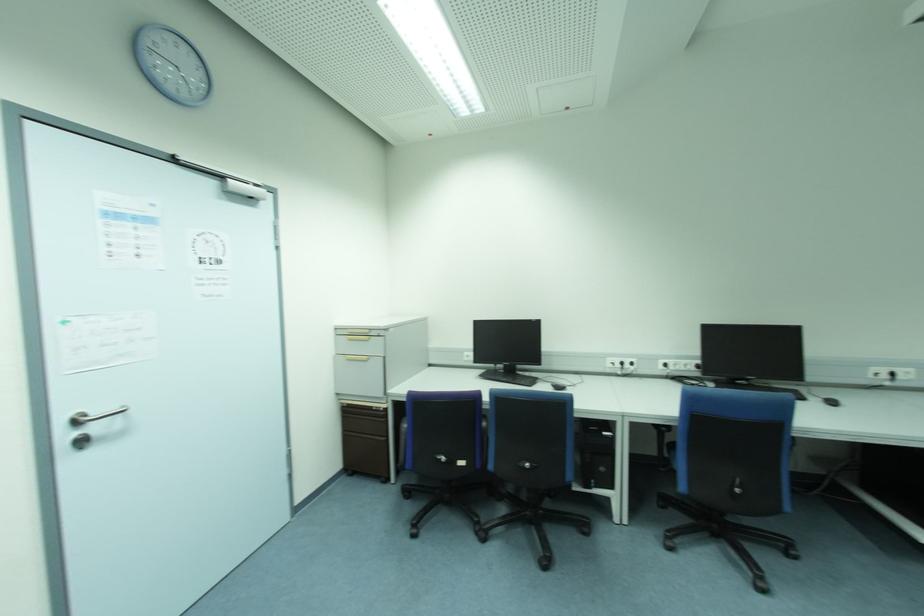
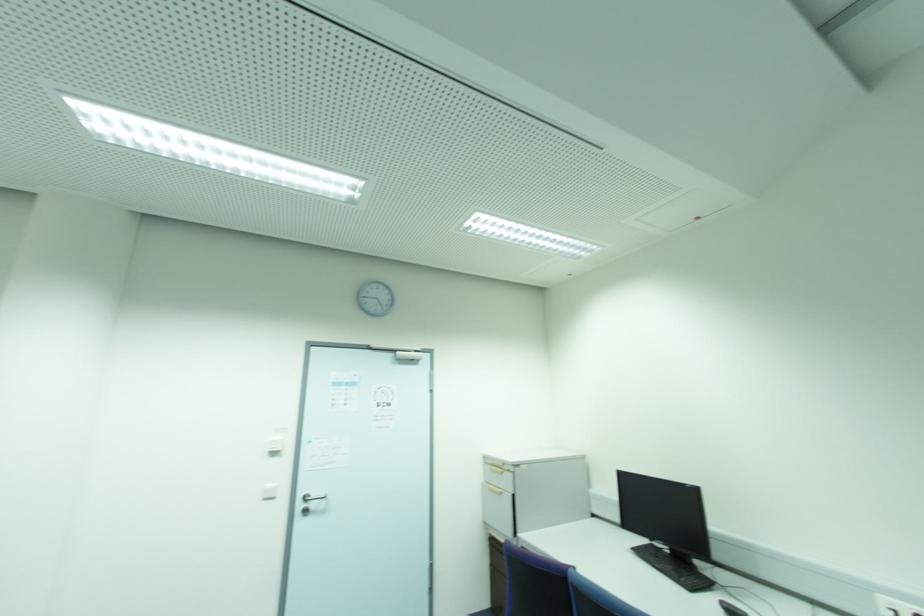
In the second image, find the point that corresponds to pixel 370 339 in the first image.

(503, 472)